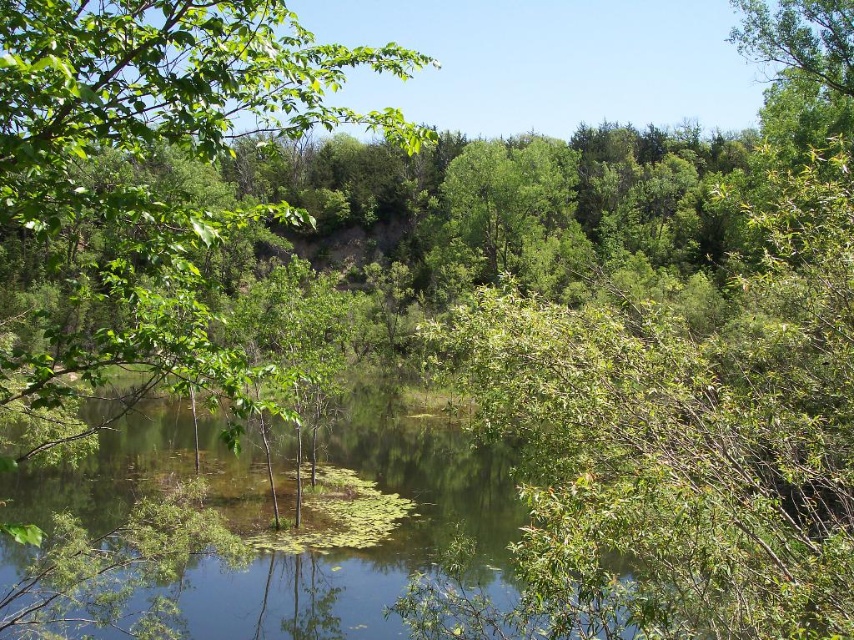
Question: Which point is farther to the camera?

Choices:
 (A) (x=416, y=140)
 (B) (x=307, y=493)

Answer: (B)

Question: In this image, where is green leafy water at center located relative to green leafy tree at center?

Choices:
 (A) below
 (B) above

Answer: (A)

Question: Is green leafy water at center to the right of green leafy tree at center from the viewer's perspective?

Choices:
 (A) yes
 (B) no

Answer: (A)

Question: Can you confirm if green leafy water at center is bigger than green leafy tree at center?

Choices:
 (A) no
 (B) yes

Answer: (A)

Question: Which point appears farthest from the camera in this image?

Choices:
 (A) (156, 616)
 (B) (225, 355)

Answer: (A)